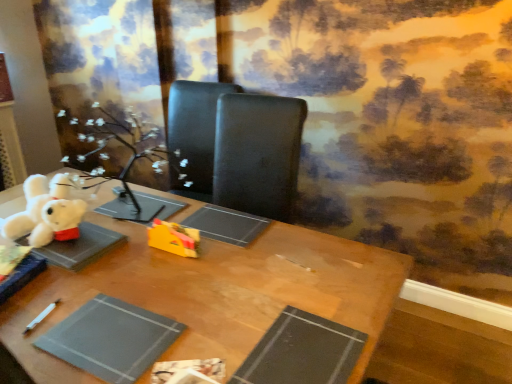
You are a GUI agent. You are given a task and a screenshot of the screen. Output one action in this format:
    pyautogui.click(x=<x>, y=<y>)
    Task: Click on the free space to the right of yellow plastic toy at center, which appears as the second toy when viewed from the left
    This screenshot has width=512, height=384.
    Given the screenshot: What is the action you would take?
    pyautogui.click(x=222, y=258)